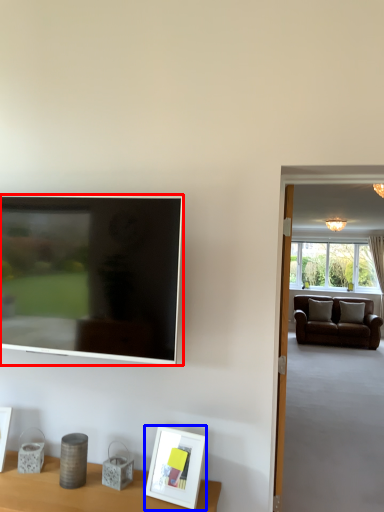
Question: Which point is further to the camera, television (highlighted by a red box) or picture frame (highlighted by a blue box)?

Choices:
 (A) television
 (B) picture frame

Answer: (A)